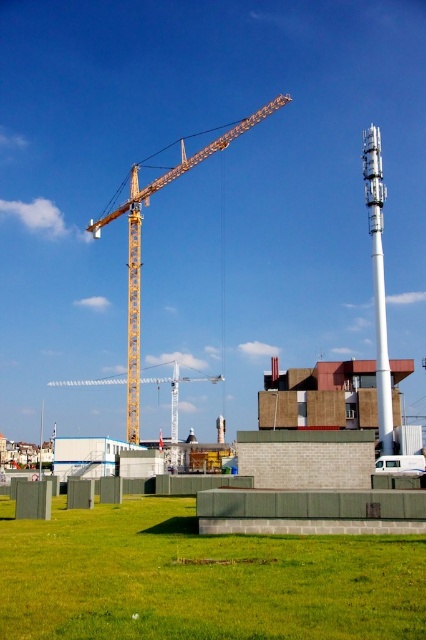
You are a city planner reviewing this construction site. You need to ensure that the yellow metallic crane at upper center and the white metallic tower at right do not block the view of the new skyscraper being built behind them. Based on their positions and sizes, which object is more likely to obstruct the view?

The yellow metallic crane at upper center might be wider than the white metallic tower at right, so it is more likely to obstruct the view of the new skyscraper behind them.

You are standing at the point marked by coordinates point (140, 243) in the urban construction site. Looking around, you see the yellow metallic crane at upper center and the telecommunications tower to the right. Which direction should you face to see the telecommunications tower?

The yellow metallic crane at upper center is represented by point (140, 243). Since the telecommunications tower is to the right of the image, you should face towards the right direction to see the telecommunications tower.